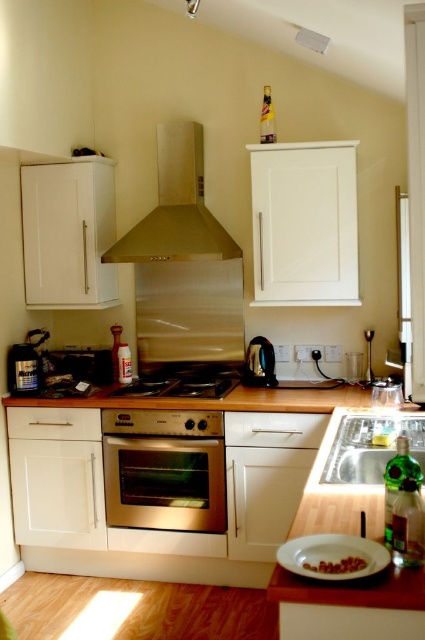
Question: Which point is closer to the camera taking this photo?

Choices:
 (A) (319, 392)
 (B) (8, 356)
 (C) (214, 374)

Answer: (A)

Question: Can you confirm if stainless steel oven at center is positioned to the right of metallic silver canister at left?

Choices:
 (A) yes
 (B) no

Answer: (A)

Question: Estimate the real-world distances between objects in this image. Which object is closer to the brown matte nuts at lower center?

Choices:
 (A) white wood countertop at center
 (B) white glossy plate at lower center
 (C) satin silver gas stove at center

Answer: (B)

Question: Does white glossy plate at lower center lie in front of metallic silver canister at left?

Choices:
 (A) yes
 (B) no

Answer: (A)

Question: Among these objects, which one is nearest to the camera?

Choices:
 (A) white glossy plate at lower center
 (B) brown matte nuts at lower center
 (C) silver metallic sink at lower right

Answer: (A)

Question: Considering the relative positions of satin silver gas stove at center and black plastic toaster at center in the image provided, where is satin silver gas stove at center located with respect to black plastic toaster at center?

Choices:
 (A) above
 (B) below

Answer: (B)